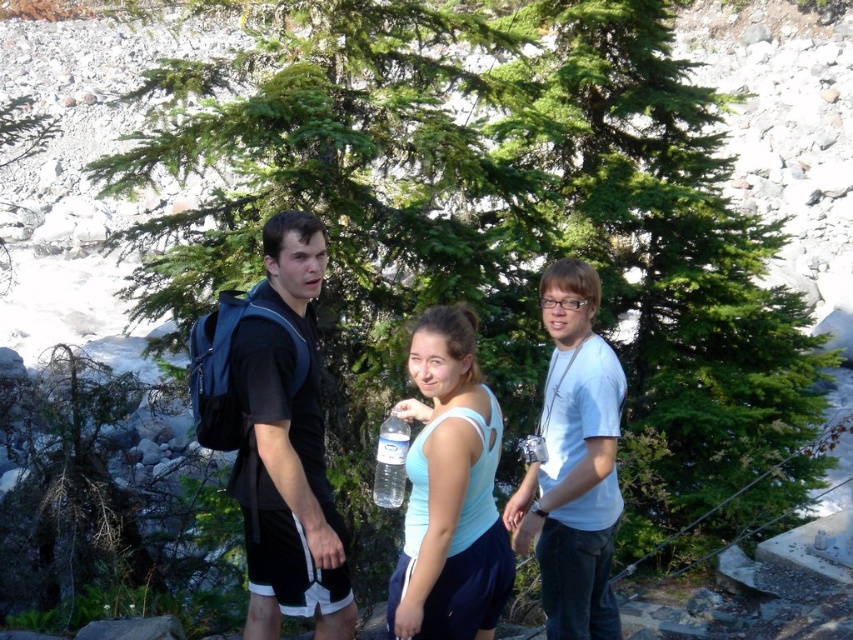
Question: Does light blue fabric tank top at center lie in front of white matte shirt at center?

Choices:
 (A) yes
 (B) no

Answer: (A)

Question: Among these objects, which one is farthest from the camera?

Choices:
 (A) white matte shirt at center
 (B) light blue fabric tank top at center

Answer: (A)

Question: Which point appears farthest from the camera in this image?

Choices:
 (A) (445, 396)
 (B) (546, 518)
 (C) (294, 452)

Answer: (B)

Question: Is the position of black matte backpack at left more distant than that of light blue fabric tank top at center?

Choices:
 (A) yes
 (B) no

Answer: (A)

Question: Which object is farther from the camera taking this photo?

Choices:
 (A) clear plastic bottle at center
 (B) black matte backpack at left
 (C) light blue fabric tank top at center

Answer: (A)

Question: Does light blue fabric tank top at center have a smaller size compared to white matte shirt at center?

Choices:
 (A) no
 (B) yes

Answer: (B)